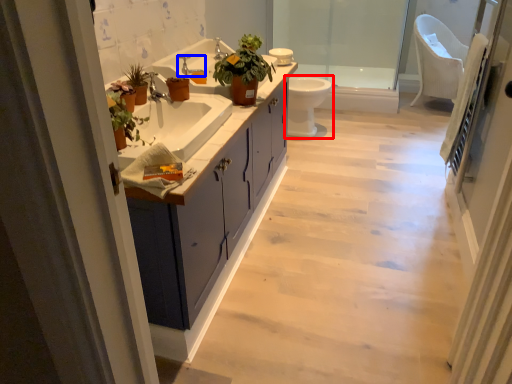
Question: Which object appears farthest to the camera in this image, toilet (highlighted by a red box) or tap (highlighted by a blue box)?

Choices:
 (A) toilet
 (B) tap

Answer: (A)